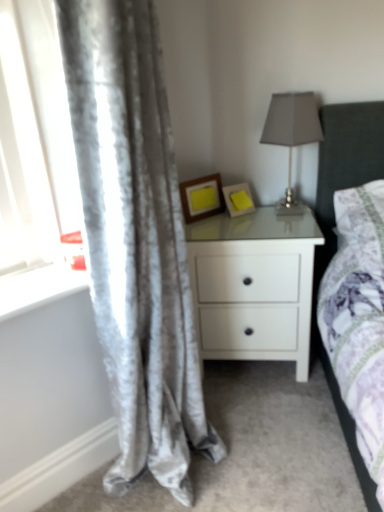
At what (x,y) coordinates should I click in order to perform the action: click on vacant area that is in front of yellow matte picture frame at center, placed as the 2th picture frame when sorted from right to left. Please return your answer as a coordinate pair (x, y). The height and width of the screenshot is (512, 384). Looking at the image, I should click on (209, 228).